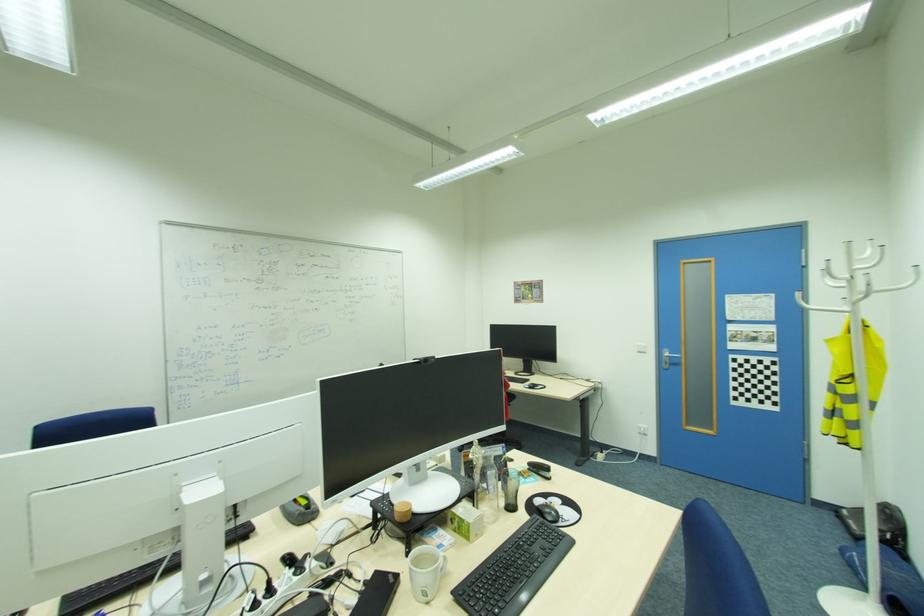
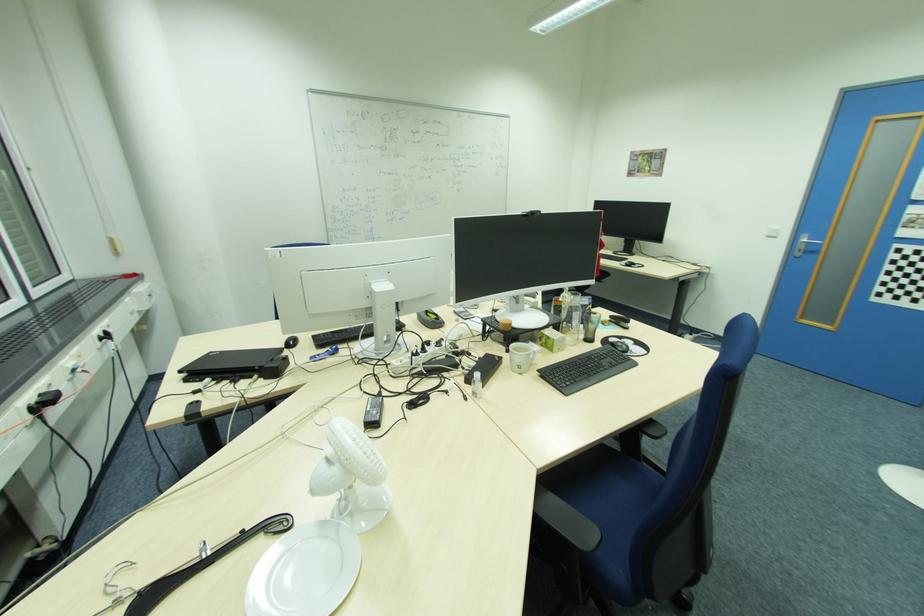
In the second image, find the point that corresponds to point (669, 363) in the first image.

(804, 251)